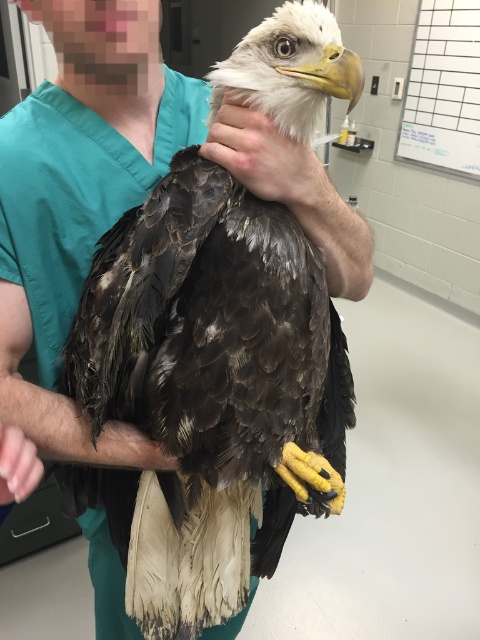
Question: Is brown feathered eagle at center below matte green scrub at upper center?

Choices:
 (A) no
 (B) yes

Answer: (B)

Question: Which object is the farthest from the brown feathered eagle at center?

Choices:
 (A) matte green scrub at upper center
 (B) pink flesh at lower left

Answer: (B)

Question: Which object appears closest to the camera in this image?

Choices:
 (A) smooth skin hand at center
 (B) pink flesh at lower left
 (C) matte green scrub at upper center

Answer: (B)

Question: Does brown feathered eagle at center appear under matte green scrub at upper center?

Choices:
 (A) no
 (B) yes

Answer: (B)

Question: Can you confirm if brown feathered eagle at center is positioned to the right of matte green scrub at upper center?

Choices:
 (A) no
 (B) yes

Answer: (A)

Question: Which of the following is the closest to the observer?

Choices:
 (A) brown feathered eagle at center
 (B) matte green scrub at upper center
 (C) pink flesh at lower left

Answer: (C)